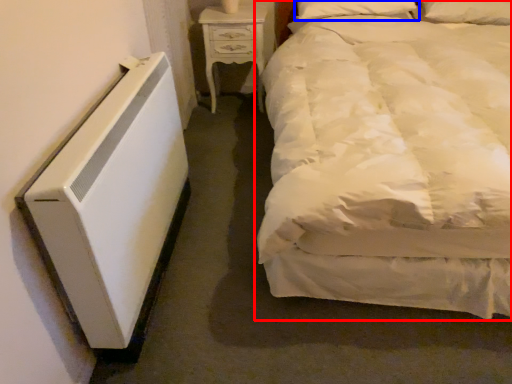
Question: Which object is further to the camera taking this photo, bed (highlighted by a red box) or pillow (highlighted by a blue box)?

Choices:
 (A) bed
 (B) pillow

Answer: (B)